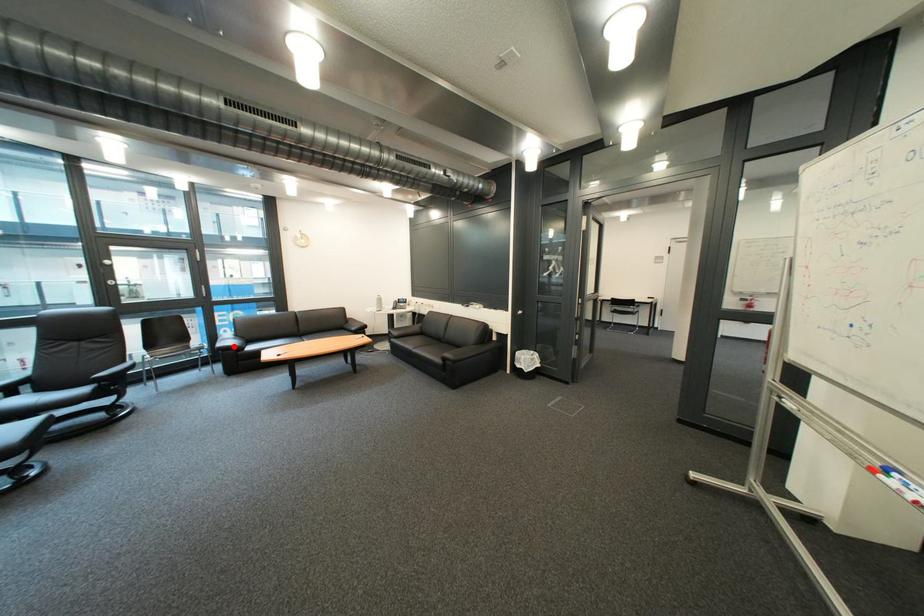
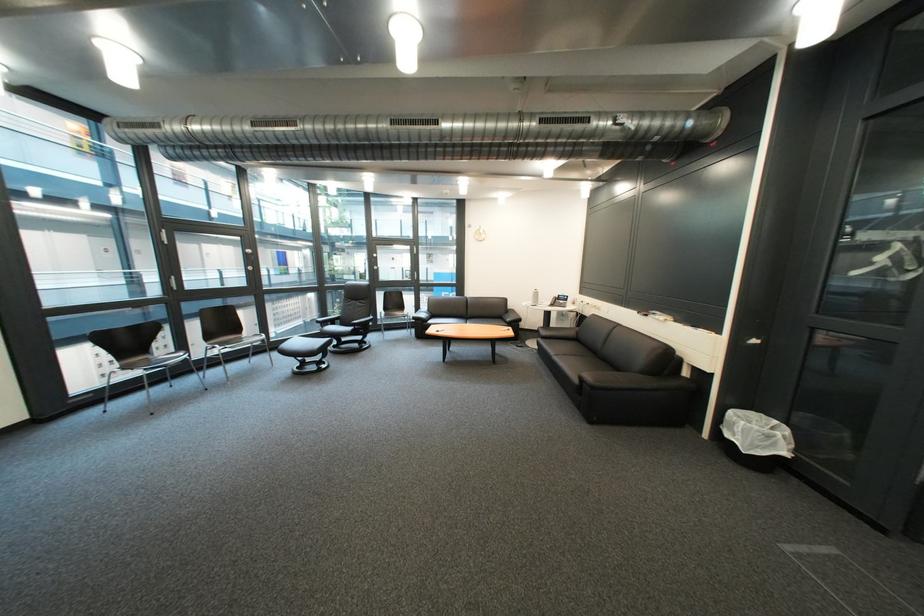
Locate, in the second image, the point that corresponds to the highlighted location in the first image.

(430, 317)